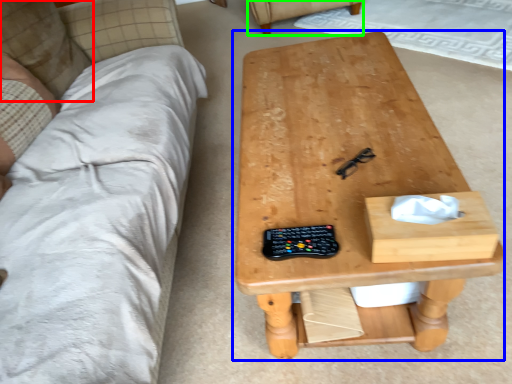
Question: Which object is positioned closest to pillow (highlighted by a red box)? Select from table (highlighted by a blue box) and armchair (highlighted by a green box).

Choices:
 (A) table
 (B) armchair

Answer: (A)